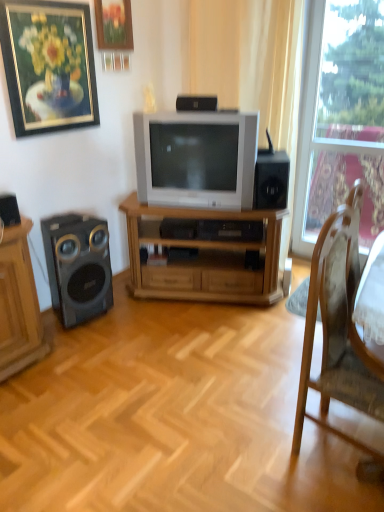
Question: Can you confirm if black matte speaker at right, which is counted as the first speaker, starting from the right, is thinner than wooden chair at right?

Choices:
 (A) no
 (B) yes

Answer: (B)

Question: Can you confirm if black matte speaker at right, the first speaker positioned from the back, is positioned to the left of wooden chair at right?

Choices:
 (A) yes
 (B) no

Answer: (A)

Question: Is black matte speaker at right, which is counted as the first speaker, starting from the right, outside of wooden chair at right?

Choices:
 (A) no
 (B) yes

Answer: (B)

Question: Is black matte speaker at right, the 3th speaker when ordered from front to back, bigger than wooden chair at right?

Choices:
 (A) no
 (B) yes

Answer: (A)

Question: Considering the relative sizes of black matte speaker at right, the 3th speaker when ordered from front to back, and wooden chair at right in the image provided, is black matte speaker at right, the 3th speaker when ordered from front to back, wider than wooden chair at right?

Choices:
 (A) no
 (B) yes

Answer: (A)

Question: Considering the relative sizes of black matte speaker at right, which appears as the 3th speaker when viewed from the left, and wooden chair at right in the image provided, is black matte speaker at right, which appears as the 3th speaker when viewed from the left, taller than wooden chair at right?

Choices:
 (A) no
 (B) yes

Answer: (A)

Question: Can you see wooden picture frame at upper center, the second picture frame in the left-to-right sequence, touching black matte speaker at upper center, the 2th speaker positioned from the back?

Choices:
 (A) no
 (B) yes

Answer: (A)

Question: Is wooden picture frame at upper center, marked as the first picture frame in a right-to-left arrangement, at the right side of black matte speaker at upper center, the 2th speaker positioned from the back?

Choices:
 (A) yes
 (B) no

Answer: (B)

Question: Does wooden picture frame at upper center, marked as the first picture frame in a right-to-left arrangement, have a lesser width compared to black matte speaker at upper center, the third speaker from the bottom?

Choices:
 (A) no
 (B) yes

Answer: (B)

Question: From a real-world perspective, is wooden picture frame at upper center, marked as the first picture frame in a right-to-left arrangement, physically above black matte speaker at upper center, acting as the 1th speaker starting from the top?

Choices:
 (A) yes
 (B) no

Answer: (A)

Question: Could you tell me if wooden picture frame at upper center, the second picture frame in the left-to-right sequence, is turned towards black matte speaker at upper center, the second speaker positioned from the right?

Choices:
 (A) no
 (B) yes

Answer: (A)

Question: Would you consider wooden picture frame at upper center, marked as the first picture frame in a right-to-left arrangement, to be distant from black matte speaker at upper center, the second speaker positioned from the right?

Choices:
 (A) no
 (B) yes

Answer: (A)

Question: From a real-world perspective, is gold-framed painting at upper left, the 1th picture frame from the left, physically above black matte speaker at right, marked as the second speaker in a bottom-to-top arrangement?

Choices:
 (A) yes
 (B) no

Answer: (A)